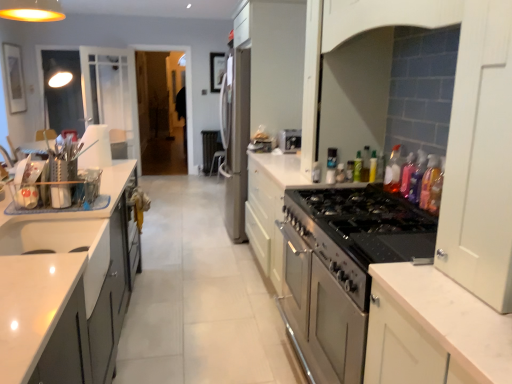
The height and width of the screenshot is (384, 512). What do you see at coordinates (393, 171) in the screenshot?
I see `translucent plastic bottle at stove top, the 4th bottle from the back` at bounding box center [393, 171].

Describe the element at coordinates (429, 180) in the screenshot. The image size is (512, 384). I see `translucent plastic bottles at upper right, marked as the seventh bottle in a back-to-front arrangement` at that location.

Describe the element at coordinates (407, 174) in the screenshot. I see `pink glossy bottle at upper right, the 3th bottle from the front` at that location.

The width and height of the screenshot is (512, 384). Find the location of `pink glossy bottle at upper right, the 3th bottle from the front`. pink glossy bottle at upper right, the 3th bottle from the front is located at coordinates pyautogui.click(x=407, y=174).

In order to face satin silver refrigerator at center, the first appliance in the back-to-front sequence, should I rotate leftwards or rightwards?

You should rotate left by 2.337 degrees.

This screenshot has width=512, height=384. I want to click on white glossy sink at lower left, so click(x=64, y=246).

Identify the location of translucent plastic bottle at stove top, the 4th bottle from the back. (393, 171).

From a real-world perspective, is translucent plastic bottle at stove top, the 4th bottle from the back, below stainless steel oven at right, which appears as the first appliance when viewed from the right?

Actually, translucent plastic bottle at stove top, the 4th bottle from the back, is physically above stainless steel oven at right, which appears as the first appliance when viewed from the right, in the real world.

Can you confirm if translucent plastic bottle at stove top, which is the 4th bottle in front-to-back order, is wider than stainless steel oven at right, the 3th appliance positioned from the top?

In fact, translucent plastic bottle at stove top, which is the 4th bottle in front-to-back order, might be narrower than stainless steel oven at right, the 3th appliance positioned from the top.

Would you say stainless steel oven at right, the 3th appliance in the back-to-front sequence, is part of translucent plastic bottle at stove top, the 4th bottle from the back,'s contents?

No, stainless steel oven at right, the 3th appliance in the back-to-front sequence, is not surrounded by translucent plastic bottle at stove top, the 4th bottle from the back.

Looking at this image, is translucent plastic bottle at stove top, which is the 4th bottle in front-to-back order, looking in the opposite direction of stainless steel oven at right, which appears as the first appliance when viewed from the right?

No, stainless steel oven at right, which appears as the first appliance when viewed from the right, is not at the back of translucent plastic bottle at stove top, which is the 4th bottle in front-to-back order.

What's the angular difference between green glass bottle at upper right, arranged as the 6th bottle when viewed from the front, and satin silver refrigerator at center, arranged as the first appliance when viewed from the left,'s facing directions?

90.6 degrees separate the facing orientations of green glass bottle at upper right, arranged as the 6th bottle when viewed from the front, and satin silver refrigerator at center, arranged as the first appliance when viewed from the left.

Does green glass bottle at upper right, acting as the second bottle starting from the back, lie behind satin silver refrigerator at center, which is the 1th appliance from top to bottom?

No, green glass bottle at upper right, acting as the second bottle starting from the back, is closer to the camera.

Are green glass bottle at upper right, arranged as the 6th bottle when viewed from the front, and satin silver refrigerator at center, which is the 1th appliance from top to bottom, far apart?

green glass bottle at upper right, arranged as the 6th bottle when viewed from the front, is positioned a significant distance from satin silver refrigerator at center, which is the 1th appliance from top to bottom.

Is green glass bottle at upper right, acting as the second bottle starting from the back, spatially inside satin silver refrigerator at center, which is the 1th appliance from top to bottom, or outside of it?

green glass bottle at upper right, acting as the second bottle starting from the back, is spatially situated outside satin silver refrigerator at center, which is the 1th appliance from top to bottom.

Could you tell me if white glossy sink at lower left is turned towards satin silver toaster at center, placed as the 2th appliance when sorted from left to right?

No, white glossy sink at lower left is not turned towards satin silver toaster at center, placed as the 2th appliance when sorted from left to right.

Which appliance is the 1st one when counting from the back of the white glossy sink at lower left? Please provide its 2D coordinates.

[(290, 140)]

Which object is closer to the camera taking this photo, white glossy sink at lower left or satin silver toaster at center, the second appliance when ordered from bottom to top?

white glossy sink at lower left is more forward.

Would you say satin silver toaster at center, which is counted as the second appliance, starting from the top, is inside or outside translucent plastic bottles at upper right, marked as the seventh bottle in a back-to-front arrangement?

The correct answer is: outside.

Which object is wider, satin silver toaster at center, the second appliance when ordered from bottom to top, or translucent plastic bottles at upper right, marked as the seventh bottle in a back-to-front arrangement?

satin silver toaster at center, the second appliance when ordered from bottom to top, is wider.

Is point (284, 137) more distant than point (423, 190)?

Yes.

Measure the distance between satin silver toaster at center, which ranks as the second appliance in front-to-back order, and translucent plastic bottles at upper right, marked as the seventh bottle in a back-to-front arrangement.

satin silver toaster at center, which ranks as the second appliance in front-to-back order, and translucent plastic bottles at upper right, marked as the seventh bottle in a back-to-front arrangement, are 1.45 meters apart from each other.

Considering the relative positions of stainless steel oven at right, the 3th appliance in the back-to-front sequence, and white glossy sink at lower left in the image provided, is stainless steel oven at right, the 3th appliance in the back-to-front sequence, to the right of white glossy sink at lower left from the viewer's perspective?

Yes.

Based on the photo, from the image's perspective, relative to white glossy sink at lower left, is stainless steel oven at right, the first appliance in the bottom-to-top sequence, above or below?

stainless steel oven at right, the first appliance in the bottom-to-top sequence, is below white glossy sink at lower left.

Can we say stainless steel oven at right, the 3th appliance in the back-to-front sequence, lies outside white glossy sink at lower left?

Indeed, stainless steel oven at right, the 3th appliance in the back-to-front sequence, is completely outside white glossy sink at lower left.

From a real-world perspective, is stainless steel oven at right, marked as the 1th appliance in a front-to-back arrangement, physically below white glossy sink at lower left?

Yes, from a real-world perspective, stainless steel oven at right, marked as the 1th appliance in a front-to-back arrangement, is below white glossy sink at lower left.

Between satin silver toaster at center, the 2th appliance viewed from the right, and translucent plastic bottle at upper right, which is the sixth bottle in back-to-front order, which one appears on the right side from the viewer's perspective?

From the viewer's perspective, translucent plastic bottle at upper right, which is the sixth bottle in back-to-front order, appears more on the right side.

Where is `the 1st appliance positioned below the translucent plastic bottle at upper right, which appears as the 2th bottle when viewed from the front (from a real-world perspective)`? This screenshot has height=384, width=512. the 1st appliance positioned below the translucent plastic bottle at upper right, which appears as the 2th bottle when viewed from the front (from a real-world perspective) is located at coordinates (290, 140).

From the image's perspective, which one is positioned higher, satin silver toaster at center, placed as the 2th appliance when sorted from left to right, or translucent plastic bottle at upper right, which is the sixth bottle in back-to-front order?

From the image's view, satin silver toaster at center, placed as the 2th appliance when sorted from left to right, is above.

Image resolution: width=512 pixels, height=384 pixels. Identify the location of bottle that is the 1st object located in front of the translucent plastic bottle at stove top, which is the 4th bottle in front-to-back order. (407, 174).

Is translucent plastic bottle at stove top, the 4th bottle from the back, bigger or smaller than pink glossy bottle at upper right, the 5th bottle when ordered from back to front?

translucent plastic bottle at stove top, the 4th bottle from the back, is bigger than pink glossy bottle at upper right, the 5th bottle when ordered from back to front.

Is translucent plastic bottle at stove top, which is the 4th bottle in front-to-back order, inside the boundaries of pink glossy bottle at upper right, the 3th bottle from the front, or outside?

translucent plastic bottle at stove top, which is the 4th bottle in front-to-back order, cannot be found inside pink glossy bottle at upper right, the 3th bottle from the front.

Locate an element on the screen. the 3rd appliance below the translucent plastic bottle at stove top, the 4th bottle from the back (from a real-world perspective) is located at coordinates (342, 269).

Where is `the 3rd appliance counting from the left of the green glass bottle at upper right, acting as the second bottle starting from the back`? the 3rd appliance counting from the left of the green glass bottle at upper right, acting as the second bottle starting from the back is located at coordinates (234, 139).

From the image, which object appears to be nearer to green glass bottle at upper right, arranged as the 6th bottle when viewed from the front, white glossy sink at lower left or translucent plastic bottle at stove top, which is the 4th bottle in front-to-back order?

translucent plastic bottle at stove top, which is the 4th bottle in front-to-back order, is closer to green glass bottle at upper right, arranged as the 6th bottle when viewed from the front.

From the picture: Estimate the real-world distances between objects in this image. Which object is closer to translucent plastic bottle at stove top, the 4th bottle from the back, green glass bottle at upper right, arranged as the 6th bottle when viewed from the front, or translucent plastic bottle at upper right, which is the sixth bottle in back-to-front order?

The object closer to translucent plastic bottle at stove top, the 4th bottle from the back, is green glass bottle at upper right, arranged as the 6th bottle when viewed from the front.

Estimate the real-world distances between objects in this image. Which object is further from satin silver refrigerator at center, the third appliance when ordered from bottom to top, pink glossy bottle at upper right, the 3th bottle from the front, or white glossy sink at lower left?

white glossy sink at lower left.

Considering their positions, is white glossy sink at lower left positioned further to satin silver toaster at center, which ranks as the second appliance in front-to-back order, than pink glossy bottle at upper right, the 5th bottle when ordered from back to front?

white glossy sink at lower left.

Considering their positions, is satin silver refrigerator at center, arranged as the first appliance when viewed from the left, positioned closer to translucent plastic bottles at upper right, marked as the seventh bottle in a back-to-front arrangement, than translucent plastic bottle at stove top, which is the 4th bottle in front-to-back order?

translucent plastic bottle at stove top, which is the 4th bottle in front-to-back order, is positioned closer to the anchor translucent plastic bottles at upper right, marked as the seventh bottle in a back-to-front arrangement.

When comparing their distances from satin silver toaster at center, the 2th appliance viewed from the right, does green glass bottle at upper right, arranged as the 6th bottle when viewed from the front, or green plastic bottle at upper right, arranged as the 1th bottle when viewed from the back, seem closer?

green glass bottle at upper right, arranged as the 6th bottle when viewed from the front.

Which object lies further to the anchor point translucent plastic bottle at upper right, which is the sixth bottle in back-to-front order, green plastic bottle at upper right, arranged as the 1th bottle when viewed from the back, or translucent plastic bottles at upper right, the 1th bottle viewed from the front?

green plastic bottle at upper right, arranged as the 1th bottle when viewed from the back, is positioned further to the anchor translucent plastic bottle at upper right, which is the sixth bottle in back-to-front order.

From the image, which object appears to be nearer to translucent plastic bottle at stove top, which is the 4th bottle in front-to-back order, satin silver refrigerator at center, positioned as the third appliance in right-to-left order, or stainless steel oven at right, the first appliance in the bottom-to-top sequence?

The object closer to translucent plastic bottle at stove top, which is the 4th bottle in front-to-back order, is stainless steel oven at right, the first appliance in the bottom-to-top sequence.

Locate an element on the screen. The image size is (512, 384). bottle positioned between translucent plastic bottle at stove top, which is the 4th bottle in front-to-back order, and green glass bottle at upper right, arranged as the 6th bottle when viewed from the front, from near to far is located at coordinates (365, 164).

What are the coordinates of `appliance between translucent plastic bottles at upper right, marked as the seventh bottle in a back-to-front arrangement, and satin silver refrigerator at center, arranged as the first appliance when viewed from the left, from front to back` in the screenshot? It's located at (290, 140).

At what (x,y) coordinates should I click in order to perform the action: click on bottle located between green glass bottle at upper right, acting as the second bottle starting from the back, and satin silver toaster at center, placed as the 2th appliance when sorted from left to right, in the depth direction. Please return your answer as a coordinate pair (x, y). The height and width of the screenshot is (384, 512). Looking at the image, I should click on (373, 167).

Find the location of a particular element. bottle between translucent plastic bottles at upper right, marked as the seventh bottle in a back-to-front arrangement, and pink glossy bottle at upper right, the 3th bottle from the front, along the z-axis is located at coordinates (417, 177).